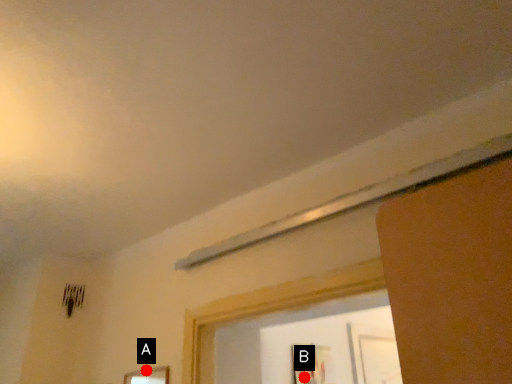
Question: Two points are circled on the image, labeled by A and B beside each circle. Among these points, which one is farthest from the camera?

Choices:
 (A) A is further
 (B) B is further

Answer: (B)